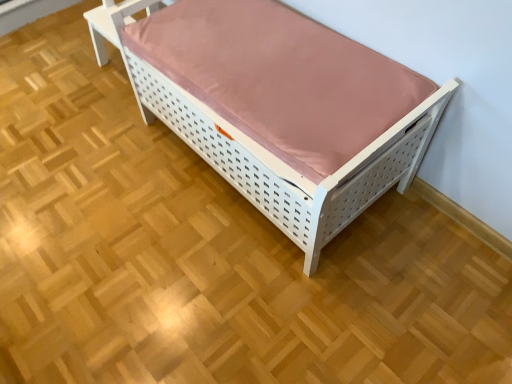
This screenshot has height=384, width=512. What do you see at coordinates (278, 106) in the screenshot? I see `white perforated bed at center` at bounding box center [278, 106].

Where is `white perforated bed at center`? white perforated bed at center is located at coordinates (278, 106).

Where is `white perforated bed at center`? The height and width of the screenshot is (384, 512). white perforated bed at center is located at coordinates (278, 106).